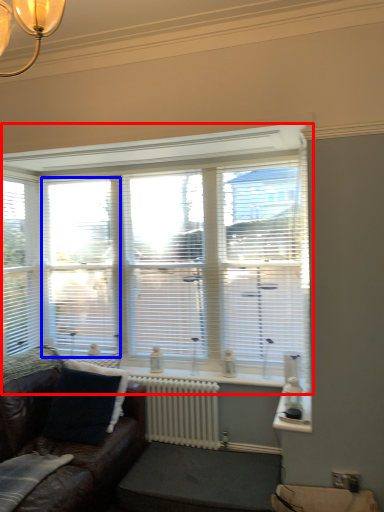
Question: Which object appears closest to the camera in this image, window (highlighted by a red box) or blind (highlighted by a blue box)?

Choices:
 (A) window
 (B) blind

Answer: (A)